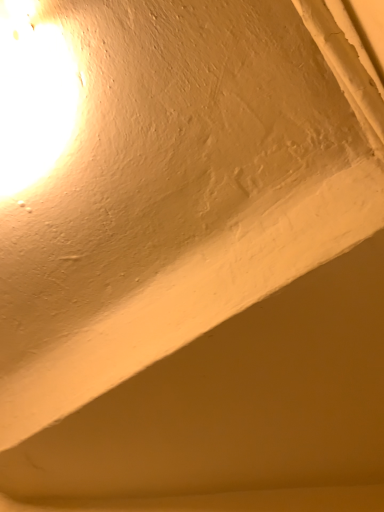
Find the location of a particular element. This screenshot has height=512, width=384. matte white droplight at upper left is located at coordinates (33, 96).

Describe the element at coordinates (33, 96) in the screenshot. Image resolution: width=384 pixels, height=512 pixels. I see `matte white droplight at upper left` at that location.

The width and height of the screenshot is (384, 512). Find the location of `matte white droplight at upper left`. matte white droplight at upper left is located at coordinates (33, 96).